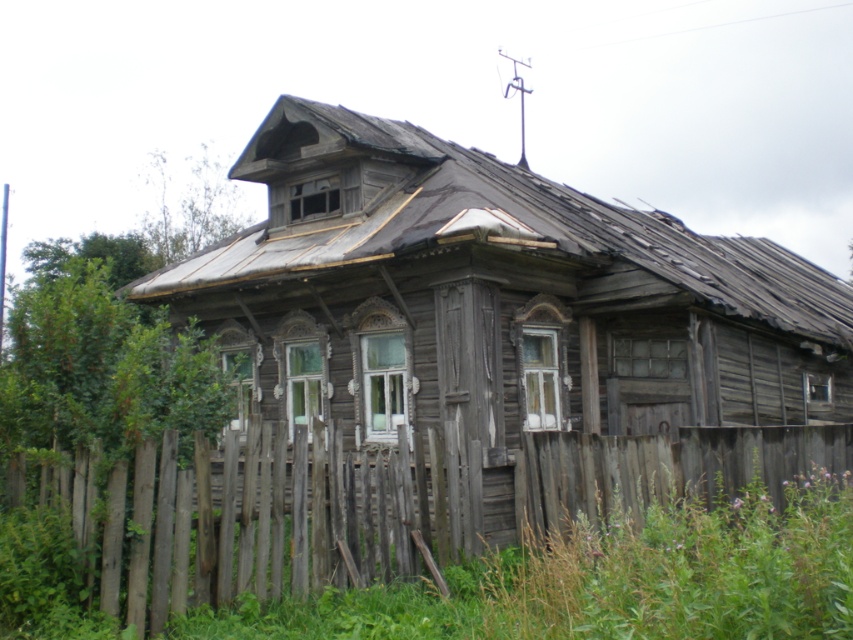
Question: Can you confirm if weathered wood hut at center is positioned to the right of weathered wood fence at lower center?

Choices:
 (A) no
 (B) yes

Answer: (B)

Question: Which point is farther to the camera?

Choices:
 (A) weathered wood hut at center
 (B) weathered wood fence at lower center

Answer: (A)

Question: Can you confirm if weathered wood hut at center is bigger than weathered wood fence at lower center?

Choices:
 (A) no
 (B) yes

Answer: (B)

Question: Which object appears closest to the camera in this image?

Choices:
 (A) weathered wood fence at lower center
 (B) weathered wood hut at center

Answer: (A)

Question: Which point appears closest to the camera in this image?

Choices:
 (A) (689, 432)
 (B) (280, 189)

Answer: (A)

Question: Considering the relative positions of weathered wood hut at center and weathered wood fence at lower center in the image provided, where is weathered wood hut at center located with respect to weathered wood fence at lower center?

Choices:
 (A) below
 (B) above

Answer: (B)